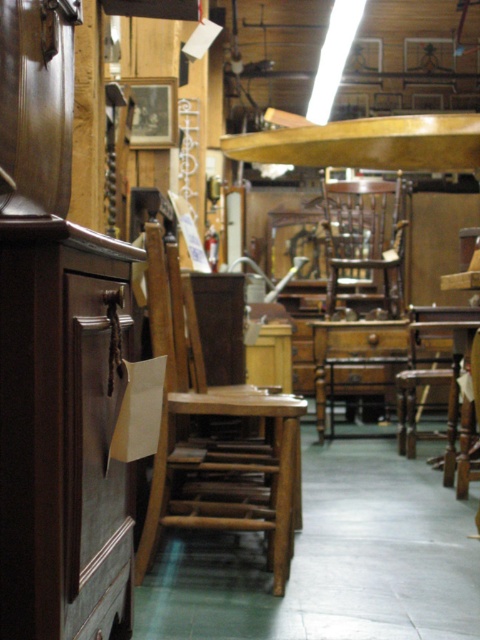
Between mahogany wood chair at center and brown matte drawer at center, which one has more height?

With more height is mahogany wood chair at center.

Is point (319, 426) positioned in front of point (360, 337)?

That is True.

Where is `mahogany wood chair at center`? The height and width of the screenshot is (640, 480). mahogany wood chair at center is located at coordinates (360, 291).

Find the location of a particular element. This screenshot has width=480, height=640. mahogany wood chair at center is located at coordinates (360, 291).

What do you see at coordinates (215, 436) in the screenshot? The width and height of the screenshot is (480, 640). I see `wooden chair at center` at bounding box center [215, 436].

Who is higher up, wooden chair at center or wooden table at center?

Positioned higher is wooden table at center.

Based on the photo, who is more forward, (286, 536) or (468, 448)?

Point (286, 536) is more forward.

Locate an element on the screen. wooden chair at center is located at coordinates (215, 436).

Does point (259, 470) come closer to viewer compared to point (332, 352)?

Yes, point (259, 470) is closer to viewer.

Image resolution: width=480 pixels, height=640 pixels. What are the coordinates of `wooden chair at center` in the screenshot? It's located at (215, 436).

Which is behind, point (193, 465) or point (403, 355)?

The point (403, 355) is behind.

This screenshot has width=480, height=640. I want to click on wooden chair at center, so click(215, 436).